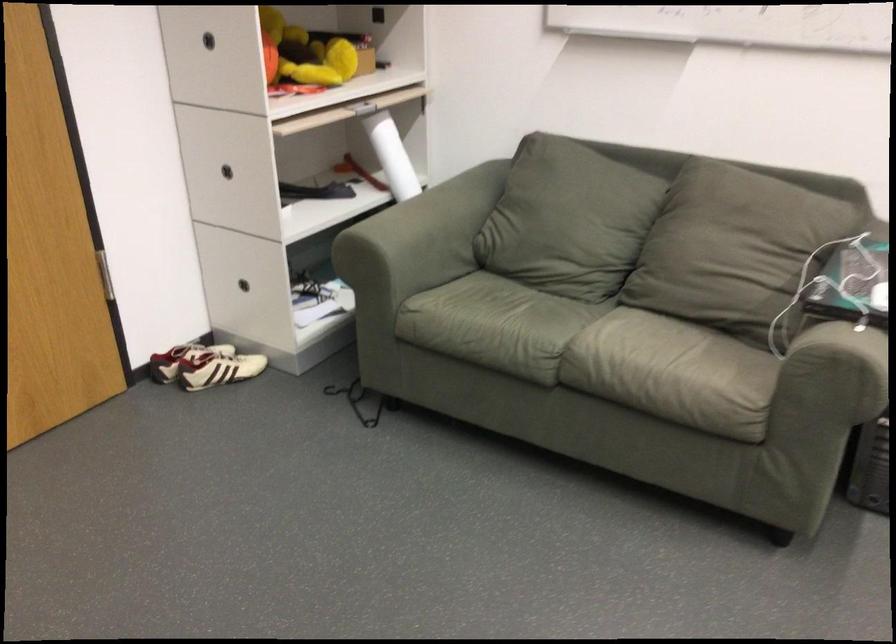
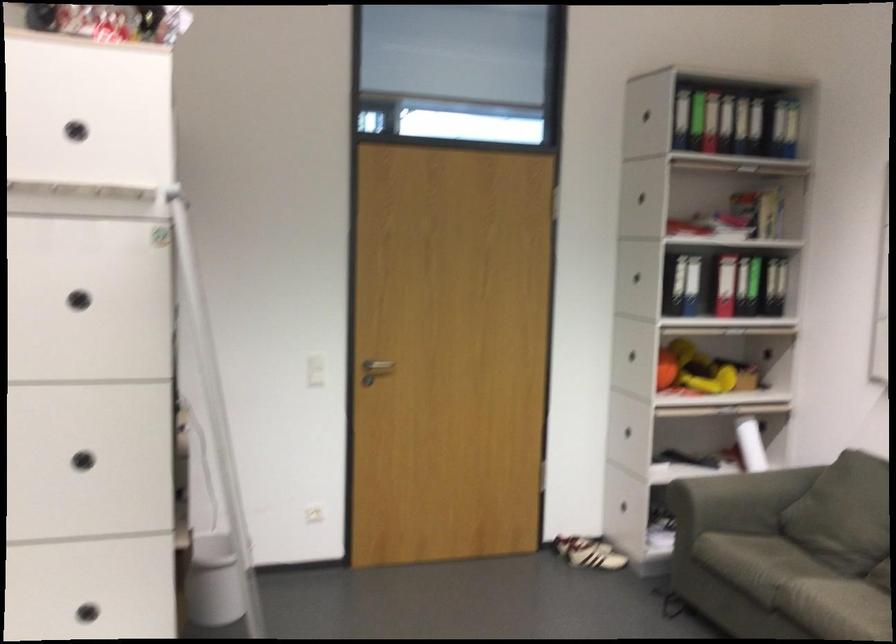
In the second image, find the point that corresponds to (x=546, y=389) in the first image.

(771, 623)